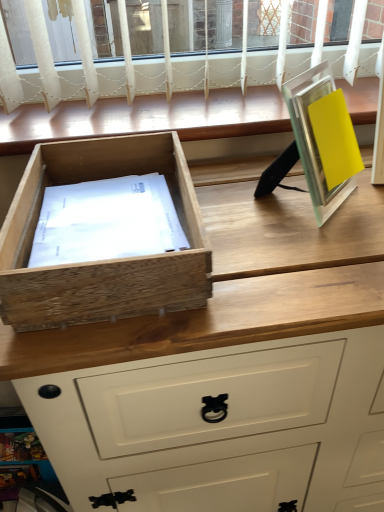
Question: From the image's perspective, does natural wood drawer at left appear higher than metallic silver picture frame at right?

Choices:
 (A) yes
 (B) no

Answer: (B)

Question: Does natural wood drawer at left have a lesser width compared to metallic silver picture frame at right?

Choices:
 (A) no
 (B) yes

Answer: (A)

Question: Is natural wood drawer at left to the right of metallic silver picture frame at right from the viewer's perspective?

Choices:
 (A) no
 (B) yes

Answer: (A)

Question: Does natural wood drawer at left appear on the left side of metallic silver picture frame at right?

Choices:
 (A) no
 (B) yes

Answer: (B)

Question: Does natural wood drawer at left lie behind metallic silver picture frame at right?

Choices:
 (A) no
 (B) yes

Answer: (A)

Question: Can you confirm if natural wood drawer at left is shorter than metallic silver picture frame at right?

Choices:
 (A) yes
 (B) no

Answer: (A)

Question: Is natural wood chest of drawers at center outside of metallic silver picture frame at right?

Choices:
 (A) no
 (B) yes

Answer: (B)

Question: Considering the relative sizes of natural wood chest of drawers at center and metallic silver picture frame at right in the image provided, is natural wood chest of drawers at center wider than metallic silver picture frame at right?

Choices:
 (A) yes
 (B) no

Answer: (A)

Question: From a real-world perspective, is natural wood chest of drawers at center on top of metallic silver picture frame at right?

Choices:
 (A) no
 (B) yes

Answer: (A)

Question: Is natural wood chest of drawers at center turned away from metallic silver picture frame at right?

Choices:
 (A) no
 (B) yes

Answer: (A)

Question: From the image's perspective, is natural wood chest of drawers at center beneath metallic silver picture frame at right?

Choices:
 (A) no
 (B) yes

Answer: (B)

Question: Could you tell me if natural wood chest of drawers at center is facing metallic silver picture frame at right?

Choices:
 (A) yes
 (B) no

Answer: (B)

Question: Does wooden window sill at upper center have a lesser width compared to metallic silver picture frame at right?

Choices:
 (A) yes
 (B) no

Answer: (B)